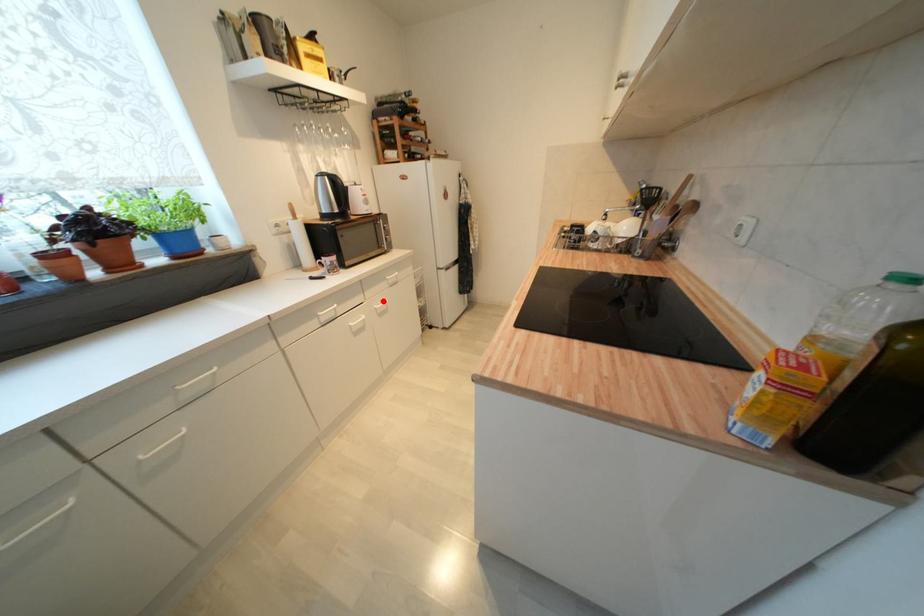
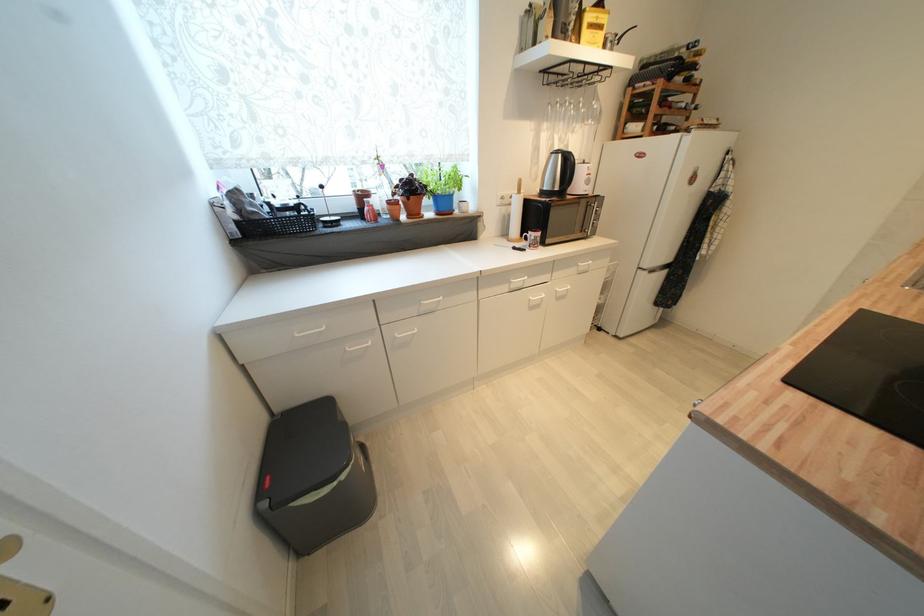
Where in the second image is the point corresponding to the highlighted location from the first image?

(566, 285)